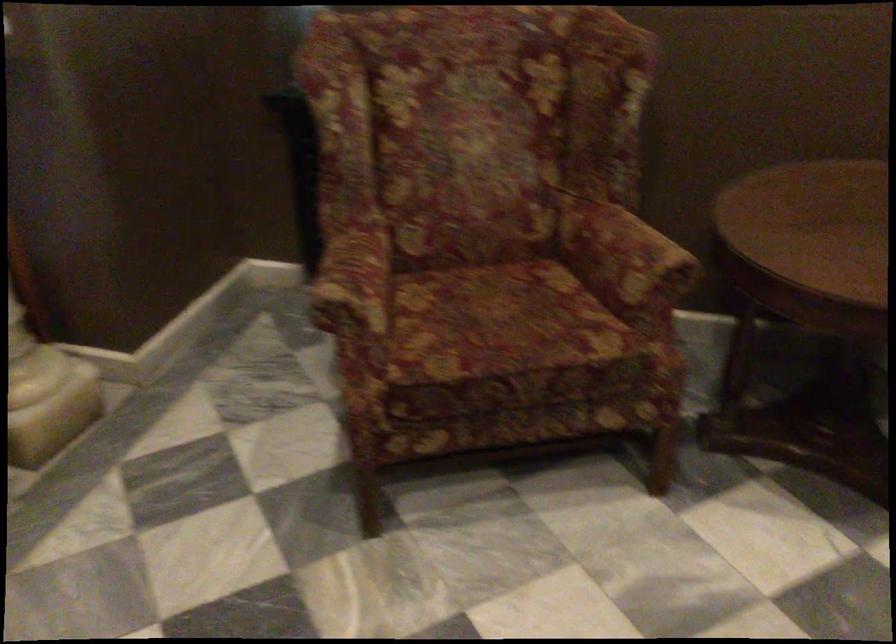
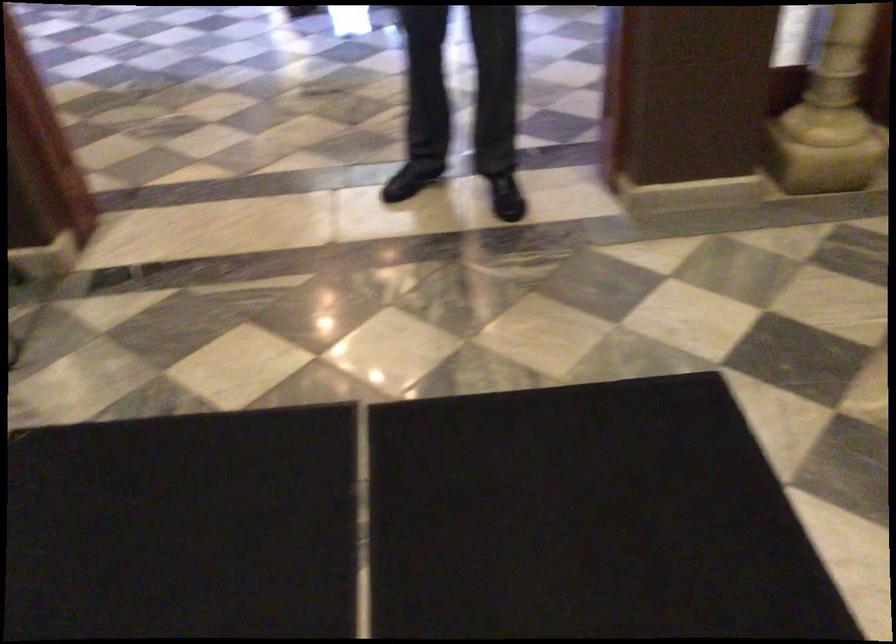
Based on the continuous images, in which direction is the camera rotating?

The camera rotated toward left-down.